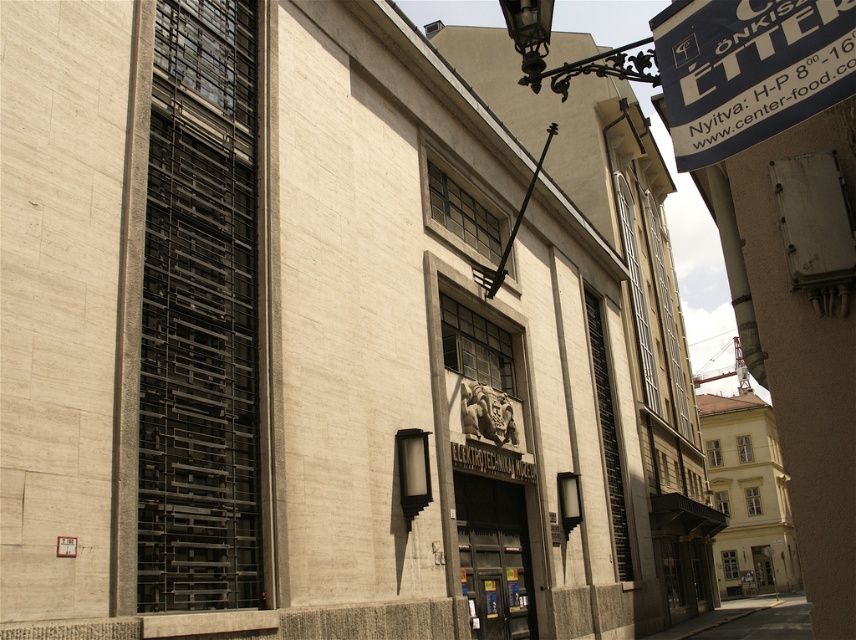
Is blue fabric sign at upper right to the right of dark gray concrete alley at lower right from the viewer's perspective?

No, blue fabric sign at upper right is not to the right of dark gray concrete alley at lower right.

You are a GUI agent. You are given a task and a screenshot of the screen. Output one action in this format:
    pyautogui.click(x=<x>, y=<y>)
    Task: Click on the blue fabric sign at upper right
    This screenshot has width=856, height=640.
    Given the screenshot: What is the action you would take?
    pyautogui.click(x=749, y=68)

Is point (764, 109) closer to viewer compared to point (663, 634)?

Yes, it is in front of point (663, 634).

Identify the location of blue fabric sign at upper right. (749, 68).